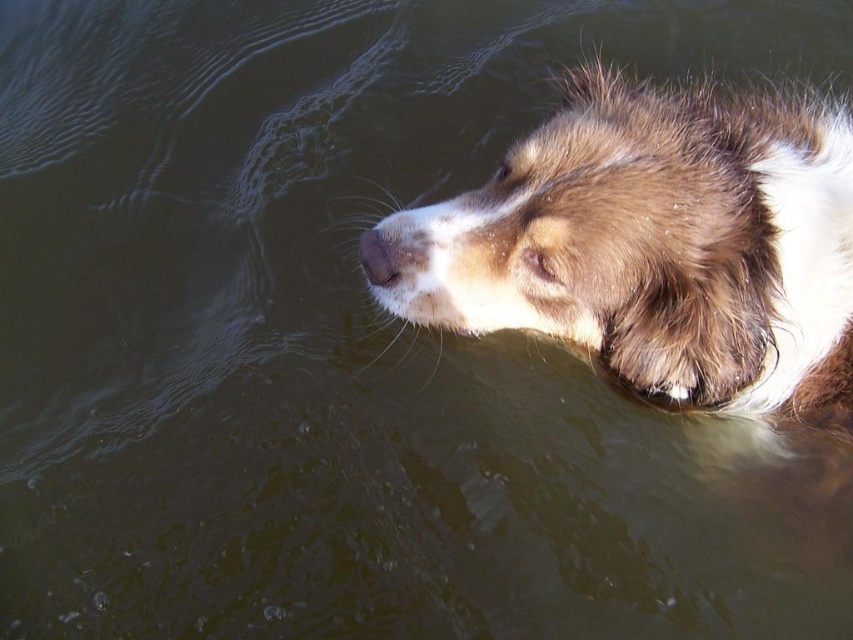
Is the position of brown fuzzy dog at upper center more distant than that of brown matte nose at upper center?

No.

Is brown fuzzy dog at upper center to the right of brown matte nose at upper center from the viewer's perspective?

Yes, brown fuzzy dog at upper center is to the right of brown matte nose at upper center.

Between point (811, 177) and point (398, 257), which one is positioned in front?

Positioned in front is point (811, 177).

Locate an element on the screen. brown fuzzy dog at upper center is located at coordinates (660, 244).